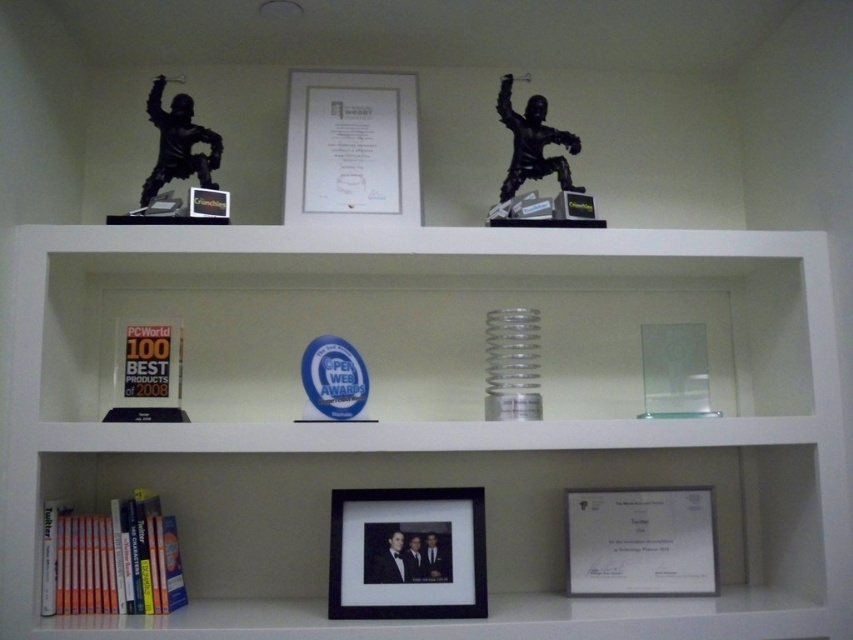
You are organizing a bookshelf and need to place a new item between the black matte picture frame at center and the hardcover books at lower left. Based on their sizes, which item should go on the bottom shelf to maintain visual balance?

The hardcover books at lower left should be placed on the bottom shelf because the black matte picture frame at center is much taller, so placing the shorter books below would help maintain visual balance.

You are organizing a display on the shelf and need to ensure that the black matte picture frame at center and the black matte statue at upper center are visible. Based on their heights, which object might require adjustment to ensure it doesn not block the view of the other?

The black matte statue at upper center is taller than the black matte picture frame at center. To ensure the picture frame is visible, you may need to adjust the statue to a lower position or place the frame in a more forward position.